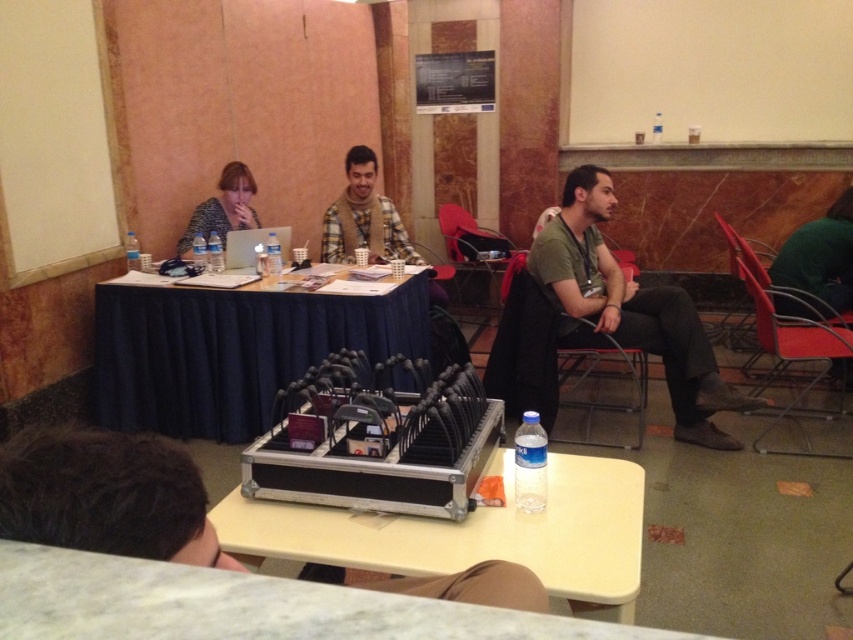
Looking at this image, you are organizing a meeting and need to place a name tag on the table. The name tag is 10 cm tall. You have two options to place it either on the matte black case at center or the plaid fabric shirt at center. Based on their heights, which object can the name tag fit on top of without hanging over the edge?

The matte black case at center is shorter than the plaid fabric shirt at center. Since the name tag is 10 cm tall, it can be placed on either object as height isn

You are a photographer setting up for a meeting. You need to position a camera so that both the matte black case at center and the plaid fabric shirt at center are in frame. Based on their positions, which object should you focus on first to ensure both are visible?

The matte black case at center is below the plaid fabric shirt at center, so you should focus on the plaid fabric shirt at center first to ensure both are visible in the frame.

You are a technician who needs to connect the plaid fabric shirt at center to the matte black case at center using a 2.5 meter cable. Will the cable be long enough to reach?

The distance between the matte black case at center and the plaid fabric shirt at center is 2.62 meters. Since the cable is only 2.5 meters long, it will be too short to make the connection.